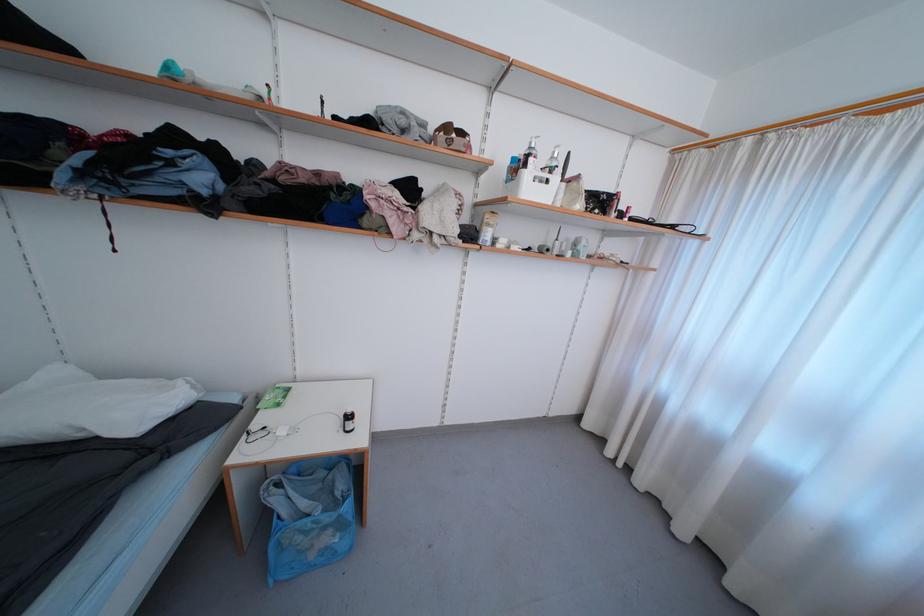
At what (x,y) coordinates should I click in order to perform the action: click on white pump dispenser. Please return your answer as a coordinate pair (x, y). The width and height of the screenshot is (924, 616). Looking at the image, I should click on (531, 148).